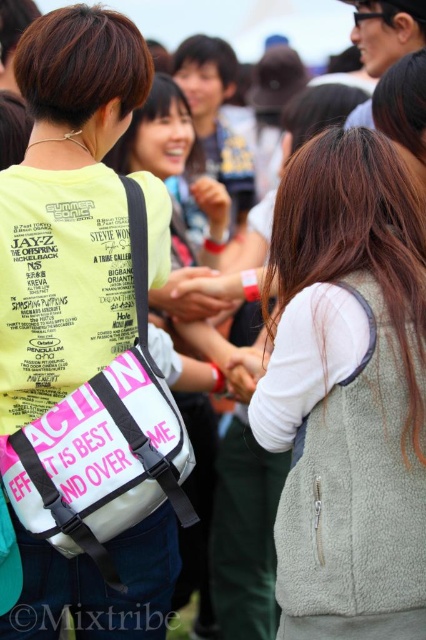
Is white matte backpack at center below smooth skin hand at center?

Yes, white matte backpack at center is below smooth skin hand at center.

Between white matte backpack at center and smooth skin hand at center, which one has more height?

Standing taller between the two is white matte backpack at center.

Between point (204, 634) and point (172, 284), which one is positioned in front?

Point (172, 284) is in front.

Where is `white matte backpack at center`? The width and height of the screenshot is (426, 640). white matte backpack at center is located at coordinates (198, 509).

How much distance is there between smooth skin hand at center and white matte hand at center?

smooth skin hand at center and white matte hand at center are 3.68 feet apart.

Which of these two, smooth skin hand at center or white matte hand at center, stands shorter?

Standing shorter between the two is white matte hand at center.

In order to click on smooth skin hand at center in this screenshot , I will do `click(187, 298)`.

Is point (170, 278) positioned in front of point (190, 188)?

Yes, point (170, 278) is closer to viewer.

Is point (155, 289) positioned behind point (199, 198)?

No, (155, 289) is closer to viewer.

Is point (181, 298) positioned before point (227, 208)?

Yes, it is in front of point (227, 208).

The width and height of the screenshot is (426, 640). In order to click on smooth skin hand at center in this screenshot , I will do `click(187, 298)`.